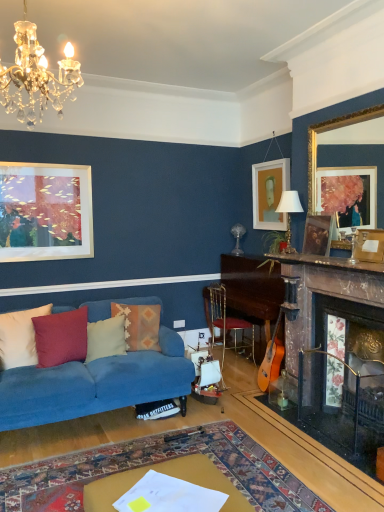
Question: Is white matte picture frame at upper center, the first picture frame from the back, to the left of wooden mantle at upper center from the viewer's perspective?

Choices:
 (A) no
 (B) yes

Answer: (B)

Question: Is white matte picture frame at upper center, the first picture frame from the back, positioned beyond the bounds of wooden mantle at upper center?

Choices:
 (A) yes
 (B) no

Answer: (A)

Question: Would you say wooden mantle at upper center is part of white matte picture frame at upper center, the first picture frame from the back,'s contents?

Choices:
 (A) no
 (B) yes

Answer: (A)

Question: From a real-world perspective, is white matte picture frame at upper center, the first picture frame from the back, located higher than wooden mantle at upper center?

Choices:
 (A) yes
 (B) no

Answer: (A)

Question: Is white matte picture frame at upper center, which is counted as the fourth picture frame, starting from the front, far from wooden mantle at upper center?

Choices:
 (A) yes
 (B) no

Answer: (A)

Question: From a real-world perspective, is white matte picture frame at upper center, which is counted as the fourth picture frame, starting from the front, positioned under wooden mantle at upper center based on gravity?

Choices:
 (A) no
 (B) yes

Answer: (A)

Question: Is wooden picture frame at right, which is counted as the 3th picture frame, starting from the back, oriented away from gold-framed mirror at upper right, the 1th picture frame viewed from the front?

Choices:
 (A) no
 (B) yes

Answer: (B)

Question: Would you say wooden picture frame at right, placed as the second picture frame when sorted from front to back, is outside gold-framed mirror at upper right, which ranks as the 4th picture frame in back-to-front order?

Choices:
 (A) no
 (B) yes

Answer: (A)

Question: Does wooden picture frame at right, placed as the second picture frame when sorted from front to back, come behind gold-framed mirror at upper right, the 1th picture frame viewed from the front?

Choices:
 (A) yes
 (B) no

Answer: (A)

Question: Considering the relative sizes of wooden picture frame at right, placed as the second picture frame when sorted from front to back, and gold-framed mirror at upper right, the 1th picture frame viewed from the front, in the image provided, is wooden picture frame at right, placed as the second picture frame when sorted from front to back, bigger than gold-framed mirror at upper right, the 1th picture frame viewed from the front,?

Choices:
 (A) yes
 (B) no

Answer: (B)

Question: From the image's perspective, does wooden picture frame at right, which is counted as the 3th picture frame, starting from the back, appear higher than gold-framed mirror at upper right, which ranks as the 4th picture frame in back-to-front order?

Choices:
 (A) yes
 (B) no

Answer: (B)

Question: Is wooden picture frame at right, which is counted as the 3th picture frame, starting from the back, oriented towards gold-framed mirror at upper right, which ranks as the 4th picture frame in back-to-front order?

Choices:
 (A) yes
 (B) no

Answer: (A)

Question: Can you confirm if white matte picture frame at upper center, the first picture frame from the back, is taller than white soft cushion at left, placed as the 4th pillow when sorted from right to left?

Choices:
 (A) no
 (B) yes

Answer: (B)